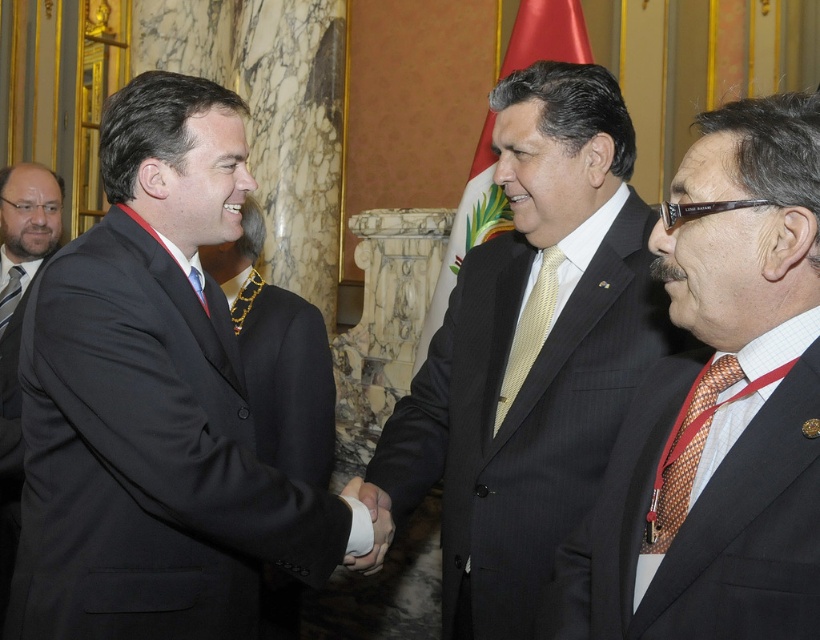
Question: Which is nearer to the pinstriped wool suit at right?

Choices:
 (A) matte black tie at left
 (B) dark pinstripe suit at center

Answer: (B)

Question: Which object is farther from the camera taking this photo?

Choices:
 (A) black matte suit at center
 (B) black matte suit at left
 (C) brown textured tie at right
 (D) pinstriped wool suit at right

Answer: (A)

Question: Which of the following is the closest to the observer?

Choices:
 (A) (693, 394)
 (B) (253, 273)
 (C) (513, 556)
 (D) (535, 284)

Answer: (A)

Question: Is dark pinstripe suit at center closer to camera compared to smooth leather hand at center?

Choices:
 (A) yes
 (B) no

Answer: (B)

Question: Where is black matte suit at left located in relation to dark pinstripe suit at center in the image?

Choices:
 (A) right
 (B) left

Answer: (B)

Question: Does black matte suit at left have a larger size compared to black matte suit at center?

Choices:
 (A) yes
 (B) no

Answer: (A)